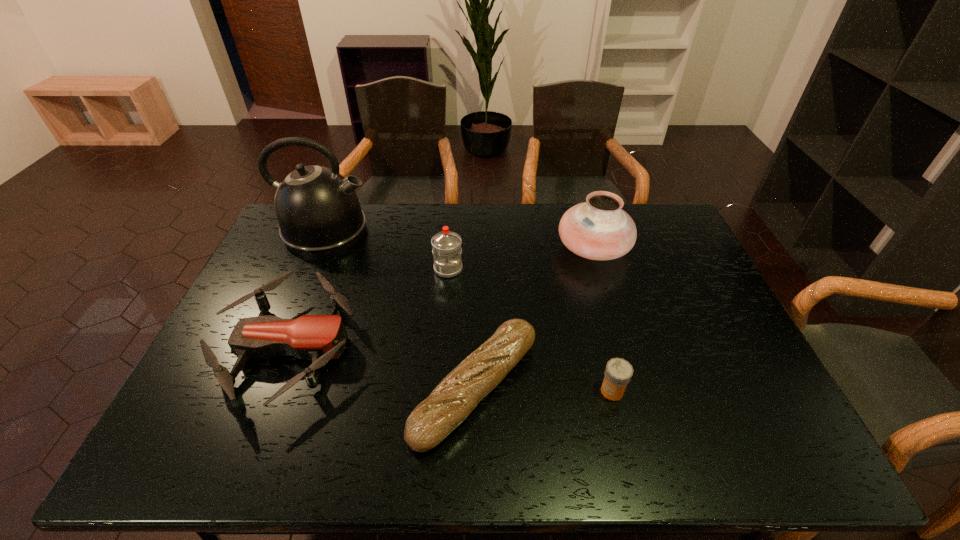
The image size is (960, 540). What are the coordinates of `blank space located on the label side of the medicine` in the screenshot? It's located at (451, 391).

Locate an element on the screen. Image resolution: width=960 pixels, height=540 pixels. free point located on the label side of the medicine is located at coordinates (492, 391).

You are a GUI agent. You are given a task and a screenshot of the screen. Output one action in this format:
    pyautogui.click(x=<x>, y=<y>)
    Task: Click on the blank space located 0.280m on the front-facing side of the drone
    Image resolution: width=960 pixels, height=540 pixels.
    Given the screenshot: What is the action you would take?
    pyautogui.click(x=458, y=348)

Locate an element on the screen. The image size is (960, 540). blank area located 0.080m on the back of the baguet is located at coordinates (476, 312).

I want to click on kettle that is at the far edge, so click(x=318, y=211).

Locate an element on the screen. This screenshot has height=540, width=960. pottery positioned at the far edge is located at coordinates (598, 229).

Where is `object that is positioned at the near edge`? This screenshot has height=540, width=960. object that is positioned at the near edge is located at coordinates (457, 395).

Where is `kettle that is at the left edge`? The image size is (960, 540). kettle that is at the left edge is located at coordinates (318, 211).

The height and width of the screenshot is (540, 960). I want to click on drone that is positioned at the left edge, so click(318, 337).

Locate an element on the screen. The height and width of the screenshot is (540, 960). object that is at the far left corner is located at coordinates (318, 211).